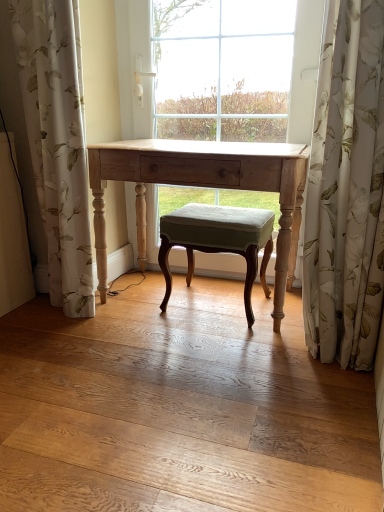
The image size is (384, 512). Identify the location of light wood table at center. 202,186.

How much space does white floral fabric at left, positioned as the second curtain in right-to-left order, occupy vertically?

It is 4.14 feet.

Where is `white floral fabric at right, which appears as the 1th curtain when viewed from the right`? The image size is (384, 512). white floral fabric at right, which appears as the 1th curtain when viewed from the right is located at coordinates (347, 190).

Considering the relative sizes of white floral fabric at right, which appears as the 1th curtain when viewed from the right, and white floral fabric at left, the 1th curtain when ordered from left to right, in the image provided, is white floral fabric at right, which appears as the 1th curtain when viewed from the right, bigger than white floral fabric at left, the 1th curtain when ordered from left to right,?

Actually, white floral fabric at right, which appears as the 1th curtain when viewed from the right, might be smaller than white floral fabric at left, the 1th curtain when ordered from left to right.

From the image's perspective, who appears lower, white floral fabric at right, which is the 2th curtain from left to right, or white floral fabric at left, the 1th curtain when ordered from left to right?

white floral fabric at right, which is the 2th curtain from left to right.

From a real-world perspective, is white floral fabric at right, which appears as the 1th curtain when viewed from the right, below white floral fabric at left, the 1th curtain when ordered from left to right?

Yes, from a real-world perspective, white floral fabric at right, which appears as the 1th curtain when viewed from the right, is beneath white floral fabric at left, the 1th curtain when ordered from left to right.

At what (x,y) coordinates should I click in order to perform the action: click on curtain located on the right of white floral fabric at left, positioned as the second curtain in right-to-left order. Please return your answer as a coordinate pair (x, y). Looking at the image, I should click on (347, 190).

Considering the sizes of objects velvet green stool at center and light wood table at center in the image provided, who is bigger, velvet green stool at center or light wood table at center?

With larger size is light wood table at center.

Can you see velvet green stool at center touching light wood table at center?

There is a gap between velvet green stool at center and light wood table at center.

From a real-world perspective, is velvet green stool at center on top of light wood table at center?

Actually, velvet green stool at center is physically below light wood table at center in the real world.

Which of these two, velvet green stool at center or light wood table at center, stands taller?

light wood table at center is taller.

Does point (52, 63) come in front of point (238, 175)?

No, it is behind (238, 175).

Measure the distance between white floral fabric at left, the 1th curtain when ordered from left to right, and light wood table at center.

13.57 inches.

Does white floral fabric at left, positioned as the second curtain in right-to-left order, appear on the right side of light wood table at center?

No.

Is white floral fabric at left, positioned as the second curtain in right-to-left order, completely or partially outside of light wood table at center?

white floral fabric at left, positioned as the second curtain in right-to-left order, is positioned outside light wood table at center.

Considering the relative positions of light wood table at center and white floral fabric at left, positioned as the second curtain in right-to-left order, in the image provided, is light wood table at center to the right of white floral fabric at left, positioned as the second curtain in right-to-left order, from the viewer's perspective?

Yes, light wood table at center is to the right of white floral fabric at left, positioned as the second curtain in right-to-left order.

In the scene shown: From the image's perspective, is light wood table at center located above white floral fabric at left, positioned as the second curtain in right-to-left order?

No, from the image's perspective, light wood table at center is not above white floral fabric at left, positioned as the second curtain in right-to-left order.

Identify the location of curtain on the left of light wood table at center. (57, 142).

Is light wood table at center further to camera compared to white floral fabric at left, the 1th curtain when ordered from left to right?

Yes, light wood table at center is further from the camera.

Is white floral fabric at right, which appears as the 1th curtain when viewed from the right, spatially inside velvet green stool at center, or outside of it?

white floral fabric at right, which appears as the 1th curtain when viewed from the right, is located beyond the bounds of velvet green stool at center.

Is white floral fabric at right, which is the 2th curtain from left to right, at the left side of velvet green stool at center?

In fact, white floral fabric at right, which is the 2th curtain from left to right, is to the right of velvet green stool at center.

Considering the sizes of objects white floral fabric at right, which is the 2th curtain from left to right, and velvet green stool at center in the image provided, who is thinner, white floral fabric at right, which is the 2th curtain from left to right, or velvet green stool at center?

Thinner between the two is white floral fabric at right, which is the 2th curtain from left to right.

Considering the positions of points (43, 221) and (265, 262), is point (43, 221) closer to camera compared to point (265, 262)?

No.

Measure the distance between white floral fabric at left, the 1th curtain when ordered from left to right, and velvet green stool at center.

white floral fabric at left, the 1th curtain when ordered from left to right, and velvet green stool at center are 21.97 inches apart from each other.

Is white floral fabric at left, positioned as the second curtain in right-to-left order, directly adjacent to velvet green stool at center?

No, white floral fabric at left, positioned as the second curtain in right-to-left order, is not making contact with velvet green stool at center.

From the image's perspective, relative to white floral fabric at left, positioned as the second curtain in right-to-left order, is velvet green stool at center above or below?

velvet green stool at center is below white floral fabric at left, positioned as the second curtain in right-to-left order.

Does velvet green stool at center have a greater height compared to white floral fabric at left, positioned as the second curtain in right-to-left order?

Incorrect, the height of velvet green stool at center is not larger of that of white floral fabric at left, positioned as the second curtain in right-to-left order.

Is velvet green stool at center thinner than white floral fabric at left, the 1th curtain when ordered from left to right?

No.

Identify the location of curtain located above the white floral fabric at right, which is the 2th curtain from left to right (from a real-world perspective). (57, 142).

Locate an element on the screen. Image resolution: width=384 pixels, height=512 pixels. table located above the velvet green stool at center (from the image's perspective) is located at coordinates (202, 186).

Considering their positions, is light wood table at center positioned closer to velvet green stool at center than white floral fabric at left, the 1th curtain when ordered from left to right?

light wood table at center is positioned closer to the anchor velvet green stool at center.

Based on their spatial positions, is white floral fabric at left, positioned as the second curtain in right-to-left order, or velvet green stool at center closer to white floral fabric at right, which is the 2th curtain from left to right?

velvet green stool at center is closer to white floral fabric at right, which is the 2th curtain from left to right.

From the image, which object appears to be farther from light wood table at center, white floral fabric at right, which is the 2th curtain from left to right, or velvet green stool at center?

white floral fabric at right, which is the 2th curtain from left to right, is further to light wood table at center.

Considering their positions, is light wood table at center positioned closer to white floral fabric at right, which is the 2th curtain from left to right, than white floral fabric at left, the 1th curtain when ordered from left to right?

light wood table at center lies closer to white floral fabric at right, which is the 2th curtain from left to right, than the other object.

Based on their spatial positions, is white floral fabric at right, which is the 2th curtain from left to right, or velvet green stool at center further from white floral fabric at left, positioned as the second curtain in right-to-left order?

white floral fabric at right, which is the 2th curtain from left to right, is positioned further to the anchor white floral fabric at left, positioned as the second curtain in right-to-left order.

Consider the image. Considering their positions, is light wood table at center positioned closer to white floral fabric at right, which appears as the 1th curtain when viewed from the right, than velvet green stool at center?

light wood table at center is closer to white floral fabric at right, which appears as the 1th curtain when viewed from the right.

Based on their spatial positions, is light wood table at center or white floral fabric at right, which appears as the 1th curtain when viewed from the right, closer to velvet green stool at center?

Based on the image, light wood table at center appears to be nearer to velvet green stool at center.

From the image, which object appears to be farther from white floral fabric at left, positioned as the second curtain in right-to-left order, light wood table at center or velvet green stool at center?

Among the two, velvet green stool at center is located further to white floral fabric at left, positioned as the second curtain in right-to-left order.

I want to click on table between white floral fabric at right, which appears as the 1th curtain when viewed from the right, and velvet green stool at center, along the z-axis, so click(202, 186).

Where is `stool between white floral fabric at left, positioned as the second curtain in right-to-left order, and white floral fabric at right, which is the 2th curtain from left to right, from left to right`? The height and width of the screenshot is (512, 384). stool between white floral fabric at left, positioned as the second curtain in right-to-left order, and white floral fabric at right, which is the 2th curtain from left to right, from left to right is located at coordinates (218, 241).

The image size is (384, 512). Identify the location of table situated between white floral fabric at left, the 1th curtain when ordered from left to right, and white floral fabric at right, which appears as the 1th curtain when viewed from the right, from left to right. (202, 186).

Identify the location of table between white floral fabric at left, positioned as the second curtain in right-to-left order, and velvet green stool at center, in the horizontal direction. (202, 186).